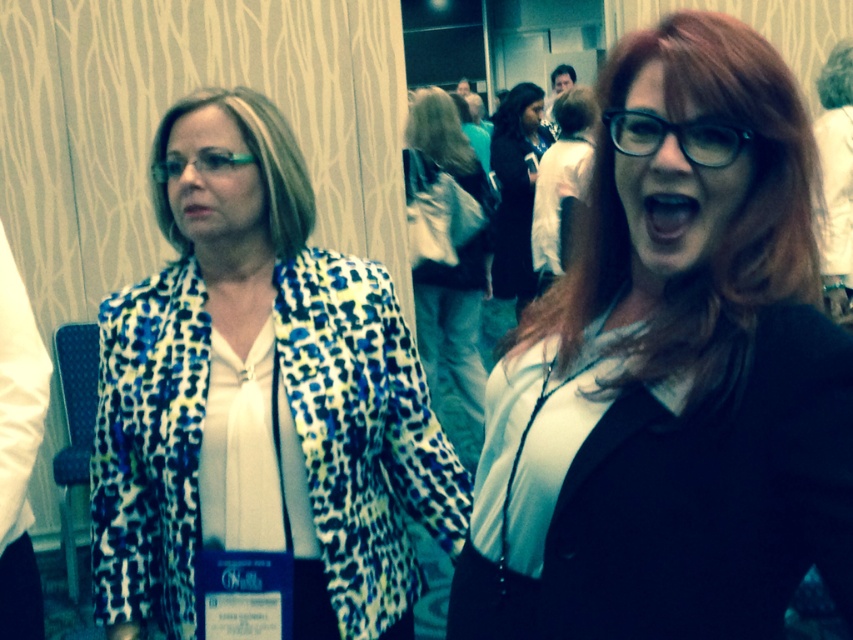
The width and height of the screenshot is (853, 640). What do you see at coordinates (672, 380) in the screenshot?
I see `matte black blazer at center` at bounding box center [672, 380].

Does matte black blazer at center have a smaller size compared to dark brown leather jacket at center?

Yes.

The width and height of the screenshot is (853, 640). What are the coordinates of `matte black blazer at center` in the screenshot? It's located at (672, 380).

Is dark brown leather jacket at center taller than translucent blue glasses at center?

Indeed, dark brown leather jacket at center has a greater height compared to translucent blue glasses at center.

The height and width of the screenshot is (640, 853). I want to click on dark brown leather jacket at center, so click(x=515, y=189).

Between leopard print blazer at left and translucent blue glasses at center, which one is positioned lower?

leopard print blazer at left is lower down.

Is leopard print blazer at left positioned in front of translucent blue glasses at center?

No, it is behind translucent blue glasses at center.

You are a GUI agent. You are given a task and a screenshot of the screen. Output one action in this format:
    pyautogui.click(x=<x>, y=<y>)
    Task: Click on the leopard print blazer at left
    The image size is (853, 640).
    Given the screenshot: What is the action you would take?
    pyautogui.click(x=260, y=401)

This screenshot has width=853, height=640. Identify the location of leopard print blazer at left. (260, 401).